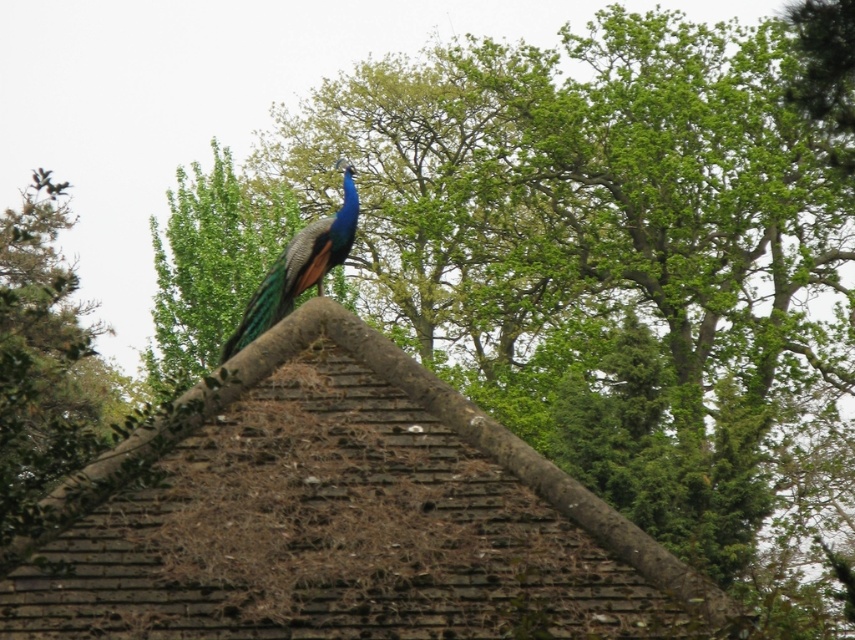
Question: Does green leafy tree at upper center come in front of shiny blue peacock at center?

Choices:
 (A) no
 (B) yes

Answer: (B)

Question: Which point is closer to the camera?

Choices:
 (A) (327, 593)
 (B) (332, 259)
 (C) (189, 257)

Answer: (A)

Question: Among these points, which one is farthest from the camera?

Choices:
 (A) (x=272, y=209)
 (B) (x=349, y=220)
 (C) (x=391, y=385)

Answer: (A)

Question: Is brown textured roof at upper center bigger than shiny blue peacock at center?

Choices:
 (A) no
 (B) yes

Answer: (B)

Question: Among these points, which one is farthest from the camera?

Choices:
 (A) (334, 216)
 (B) (199, 227)
 (C) (594, 609)

Answer: (B)

Question: Is brown textured roof at upper center positioned in front of shiny blue peacock at center?

Choices:
 (A) no
 (B) yes

Answer: (B)